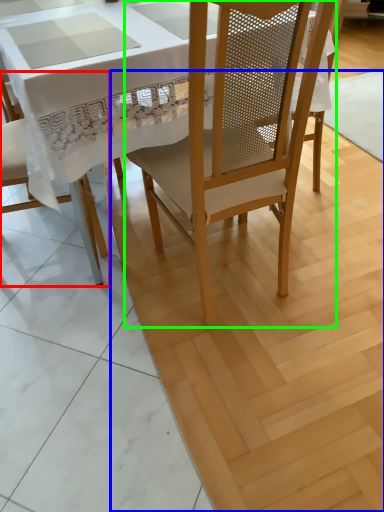
Question: Which is farther away from chair (highlighted by a red box)? plywood (highlighted by a blue box) or chair (highlighted by a green box)?

Choices:
 (A) plywood
 (B) chair

Answer: (B)